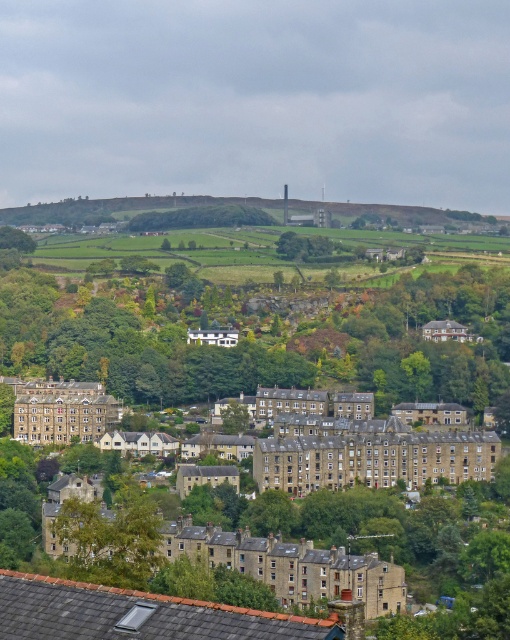
You are an aerial photographer planning to capture the landscape. You notice two green leafy trees in the scene. Which tree would appear larger in your photo if you focus on the green leafy tree at lower left and the green leafy tree at center?

The green leafy tree at lower left would appear larger in the photo because it is bigger than the green leafy tree at center.